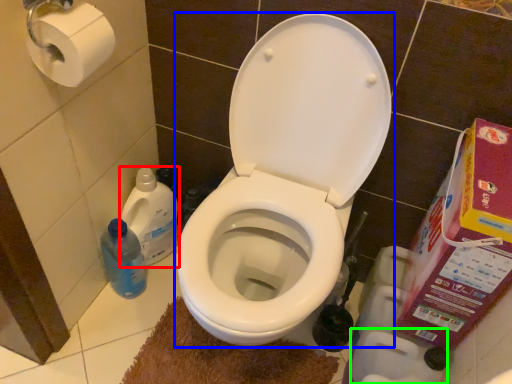
Question: Based on their relative distances, which object is farther from cleaning product (highlighted by a red box)? Choose from toilet (highlighted by a blue box) and toilet paper (highlighted by a green box).

Choices:
 (A) toilet
 (B) toilet paper

Answer: (B)